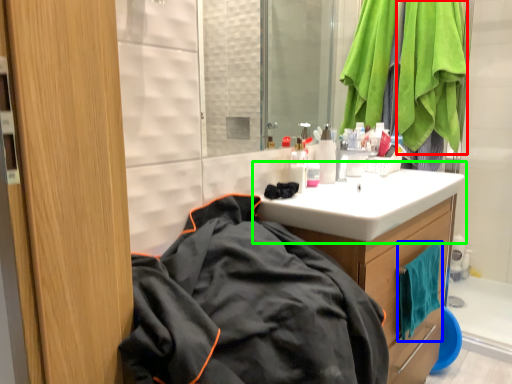
Question: Considering the real-world distances, which object is closest to blanket (highlighted by a red box)? beach towel (highlighted by a blue box) or sink (highlighted by a green box).

Choices:
 (A) beach towel
 (B) sink

Answer: (B)